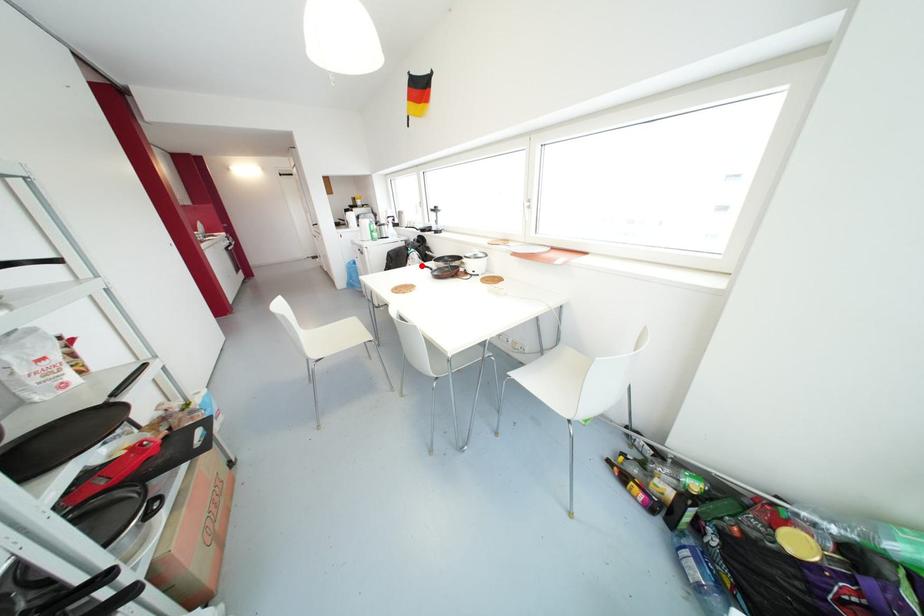
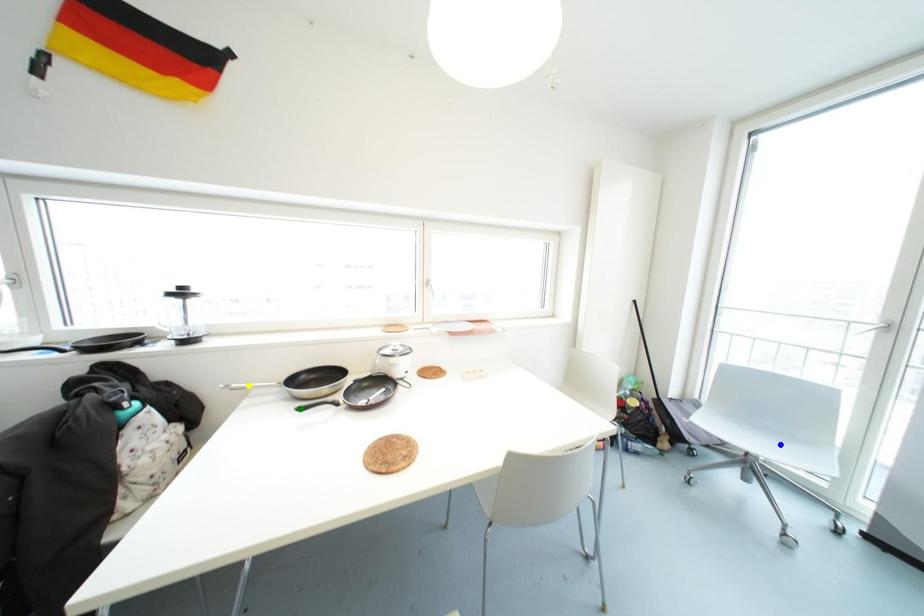
Question: I am providing you with two images of the same scene from different viewpoints. A red point is marked on the first image. You are given multiple points on the second image. In image 2, which mark is for the same physical point as the one in image 1?

Choices:
 (A) yellow point
 (B) green point
 (C) blue point

Answer: (B)